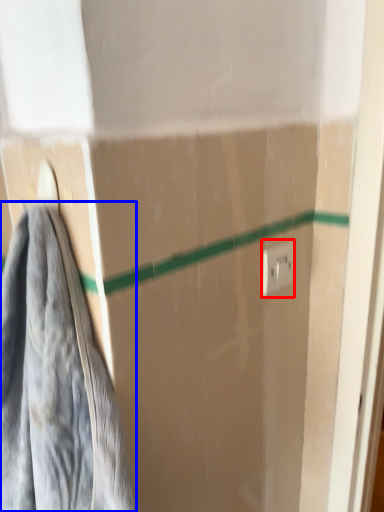
Question: Which object appears closest to the camera in this image, electric outlet (highlighted by a red box) or towel (highlighted by a blue box)?

Choices:
 (A) electric outlet
 (B) towel

Answer: (B)